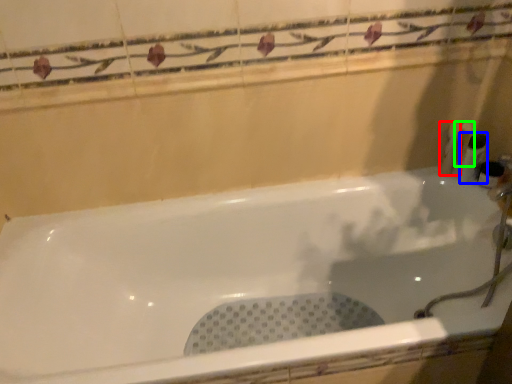
Question: Which object is the closest to the toiletry (highlighted by a red box)? Choose among these: toiletry (highlighted by a blue box) or toiletry (highlighted by a green box).

Choices:
 (A) toiletry
 (B) toiletry

Answer: (B)